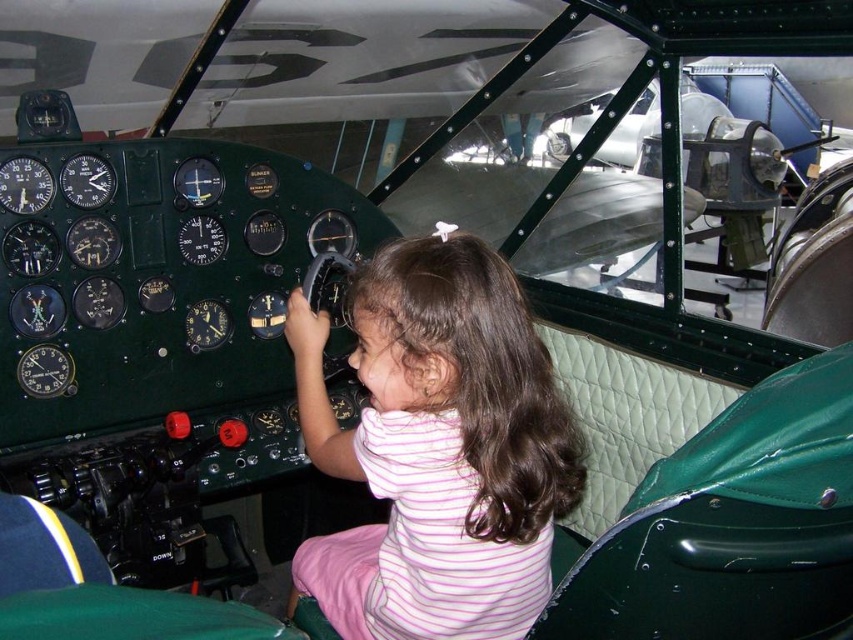
Which is in front, point (467, 243) or point (148, 605)?

Point (148, 605) is in front.

Image resolution: width=853 pixels, height=640 pixels. I want to click on pink striped shirt at center, so click(438, 449).